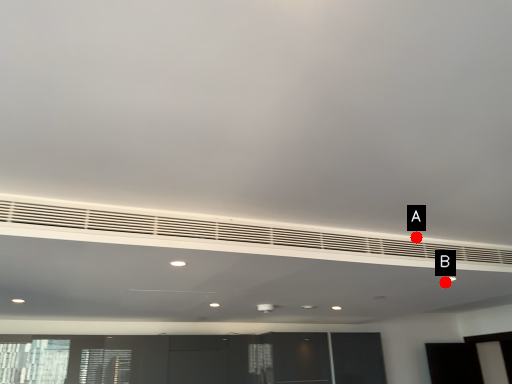
Question: Two points are circled on the image, labeled by A and B beside each circle. Among these points, which one is farthest from the camera?

Choices:
 (A) A is further
 (B) B is further

Answer: (B)